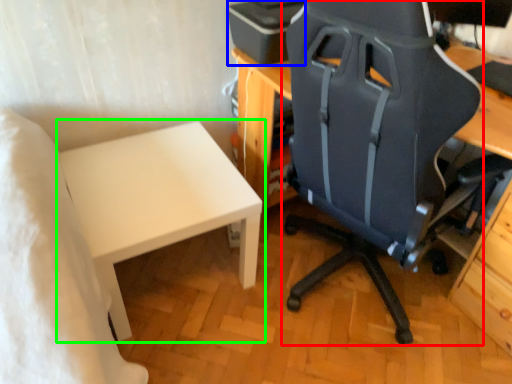
Question: Considering the real-world distances, which object is farthest from chair (highlighted by a red box)? printer (highlighted by a blue box) or table (highlighted by a green box)?

Choices:
 (A) printer
 (B) table

Answer: (B)